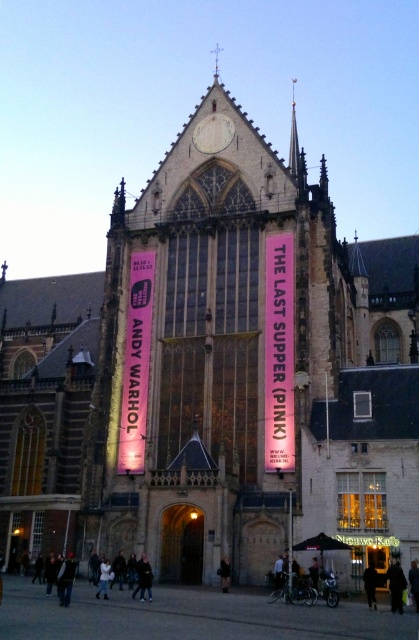
You are standing in front of the Gothic church and see the dark gray jacket at lower right and the black fabric person at lower right. Which object is taller?

The dark gray jacket at lower right is much taller than the black fabric person at lower right.

You are standing in front of the church and notice two jackets at the lower center of the image. Which jacket is closer to you, the dark gray jacket at lower center or the black leather jacket at lower center?

The dark gray jacket at lower center is closer to you because it is in front of the black leather jacket at lower center.